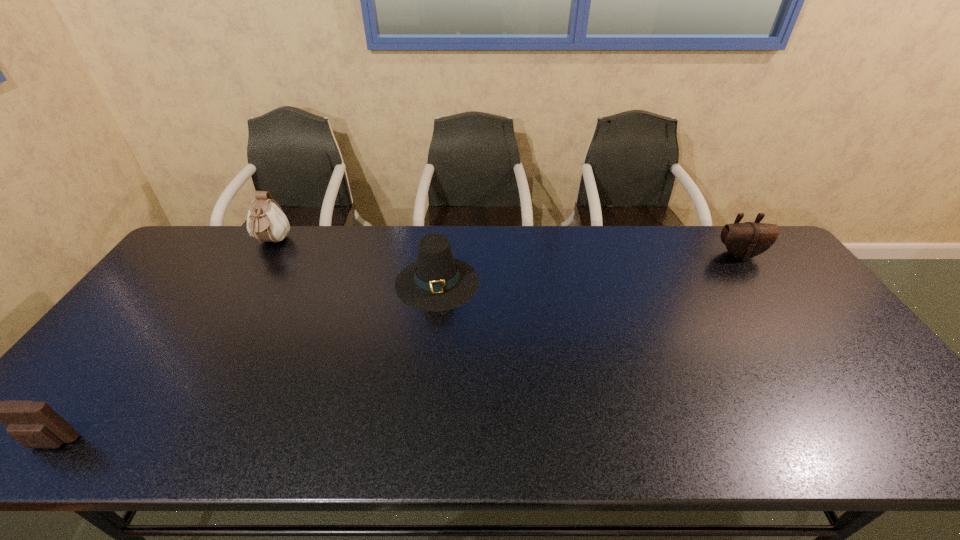
At what (x,y) coordinates should I click in order to perform the action: click on the tallest pouch. Please return your answer as a coordinate pair (x, y). This screenshot has height=540, width=960. Looking at the image, I should click on (266, 221).

Where is `the second pouch from left to right`? This screenshot has width=960, height=540. the second pouch from left to right is located at coordinates (266, 221).

What are the coordinates of `hat` in the screenshot? It's located at (436, 281).

Where is `the rightmost object`? the rightmost object is located at coordinates (745, 240).

Where is `the leftmost object`? the leftmost object is located at coordinates (33, 424).

Identify the location of the nearest pouch. The height and width of the screenshot is (540, 960). (33, 424).

You are a GUI agent. You are given a task and a screenshot of the screen. Output one action in this format:
    pyautogui.click(x=<x>, y=<y>)
    Task: Click on the free space located on the front-facing side of the tallest pouch
    
    Given the screenshot: What is the action you would take?
    252,276

I want to click on vacant space located on the front-facing side of the hat, so click(425, 392).

The height and width of the screenshot is (540, 960). In order to click on free space located 0.200m with the flap open on the rightmost object in this screenshot , I will do `click(777, 306)`.

Identify the location of hat that is positioned at the far edge. (436, 281).